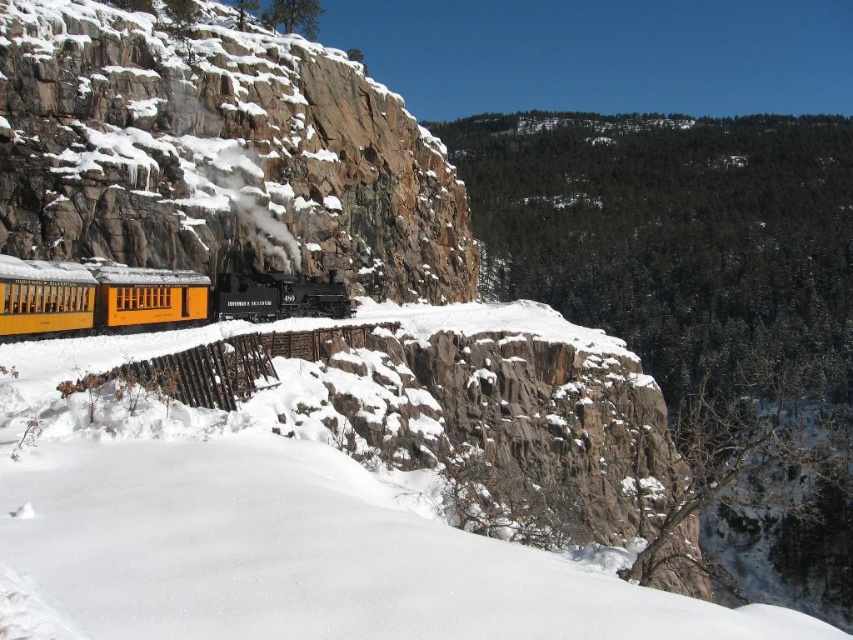
Is the position of rocky cliff at center less distant than that of yellow matte train car at center?

No, it is behind yellow matte train car at center.

Is rocky cliff at center above yellow matte train car at center?

Indeed, rocky cliff at center is positioned over yellow matte train car at center.

This screenshot has width=853, height=640. Describe the element at coordinates (218, 154) in the screenshot. I see `rocky cliff at center` at that location.

Image resolution: width=853 pixels, height=640 pixels. What are the coordinates of `rocky cliff at center` in the screenshot? It's located at (218, 154).